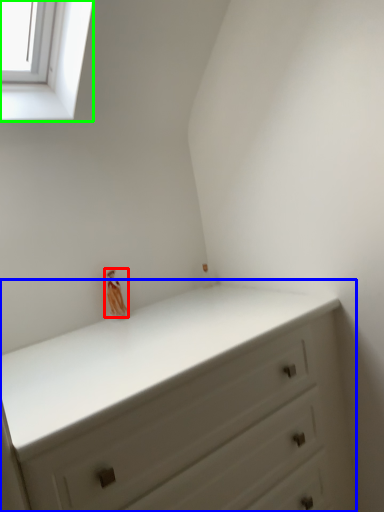
Question: Which object is positioned farthest from miniature (highlighted by a red box)? Select from chest of drawers (highlighted by a blue box) and window (highlighted by a green box).

Choices:
 (A) chest of drawers
 (B) window

Answer: (B)